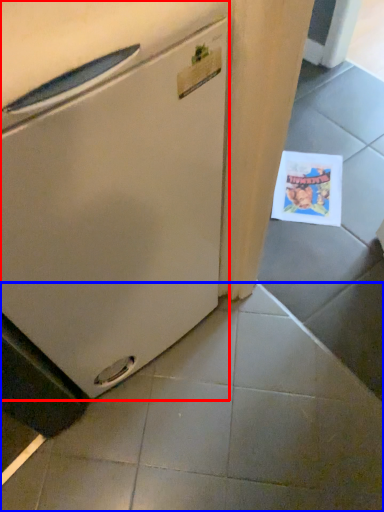
Question: Among these objects, which one is farthest to the camera, refrigerator (highlighted by a red box) or tile (highlighted by a blue box)?

Choices:
 (A) refrigerator
 (B) tile

Answer: (B)